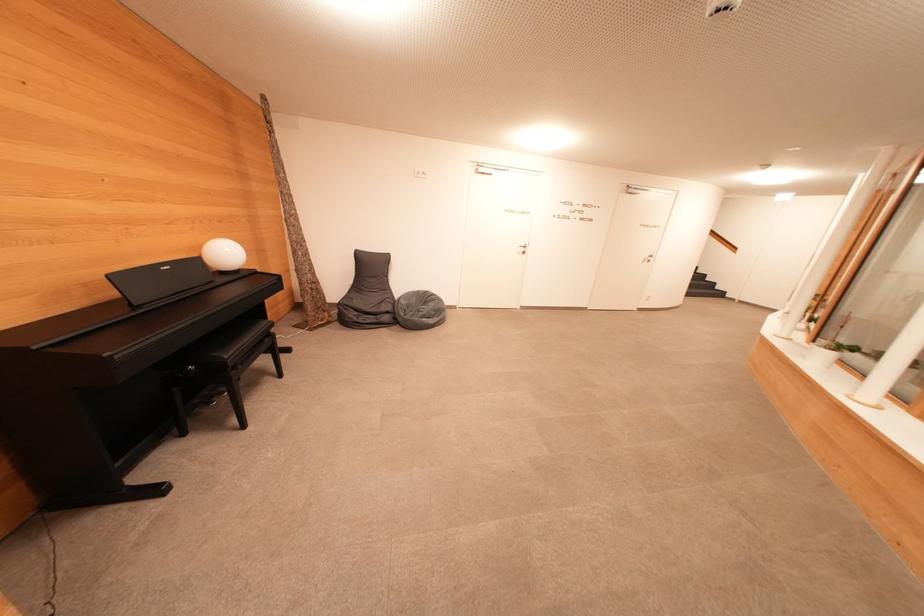
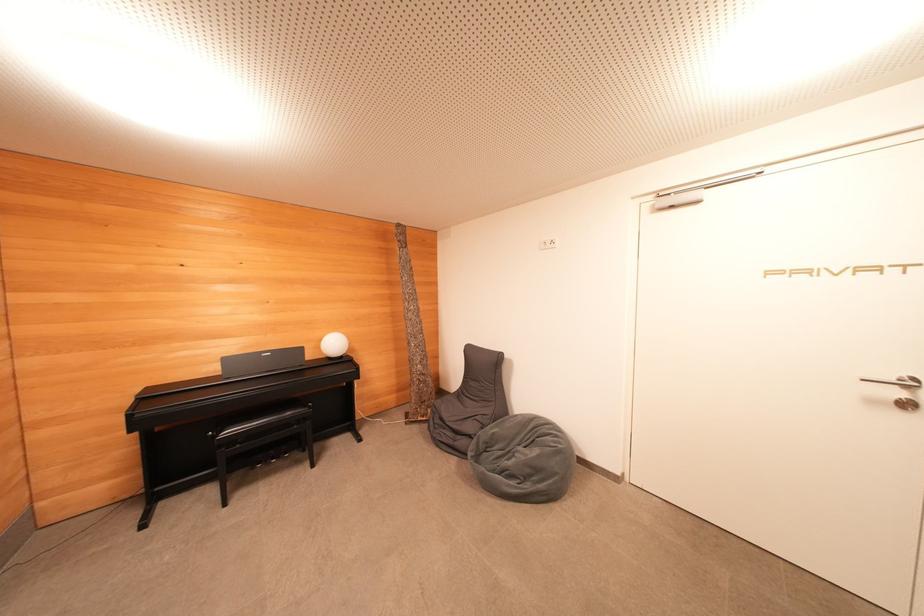
Where in the second image is the point corresponding to pixel 434 307 from the first image?

(540, 455)